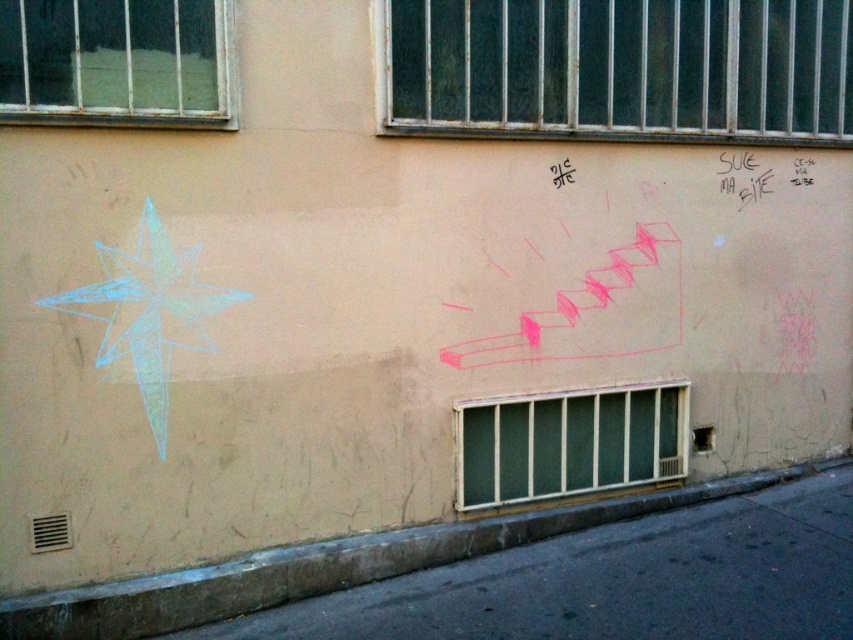
Question: Which of the following is the farthest from the observer?

Choices:
 (A) black chalk writing at upper right
 (B) black chalk graffiti at upper right

Answer: (A)

Question: Which point is closer to the camera taking this photo?

Choices:
 (A) (801, 164)
 (B) (146, 394)
 (C) (759, 186)

Answer: (B)

Question: Does blue chalk star at upper left have a larger size compared to black chalk writing at upper right?

Choices:
 (A) yes
 (B) no

Answer: (A)

Question: Is black chalk graffiti at upper right positioned at the back of black chalk writing at upper right?

Choices:
 (A) no
 (B) yes

Answer: (A)

Question: Is blue chalk star at upper left below black chalk writing at upper right?

Choices:
 (A) yes
 (B) no

Answer: (A)

Question: Which of the following is the closest to the observer?

Choices:
 (A) (761, 188)
 (B) (161, 337)
 (C) (808, 172)

Answer: (B)